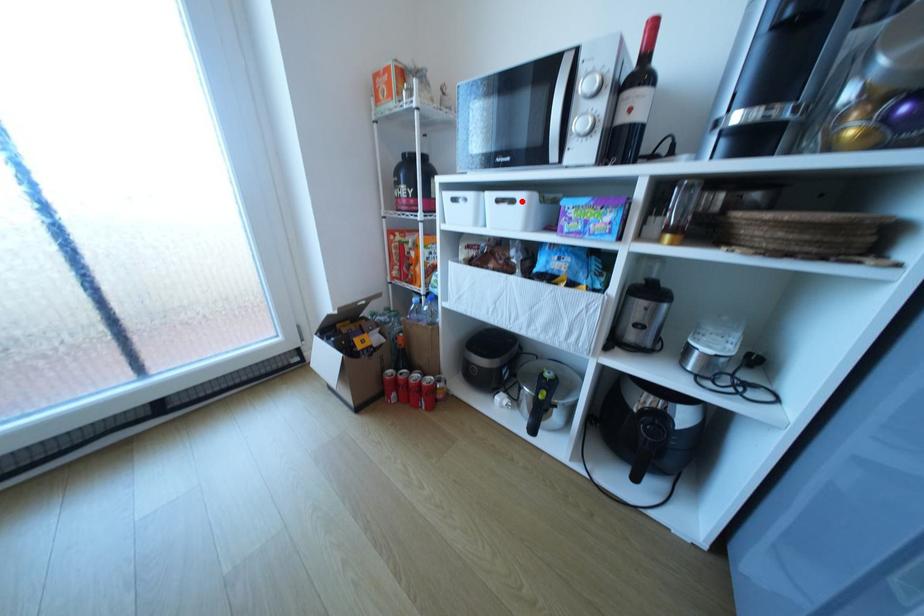
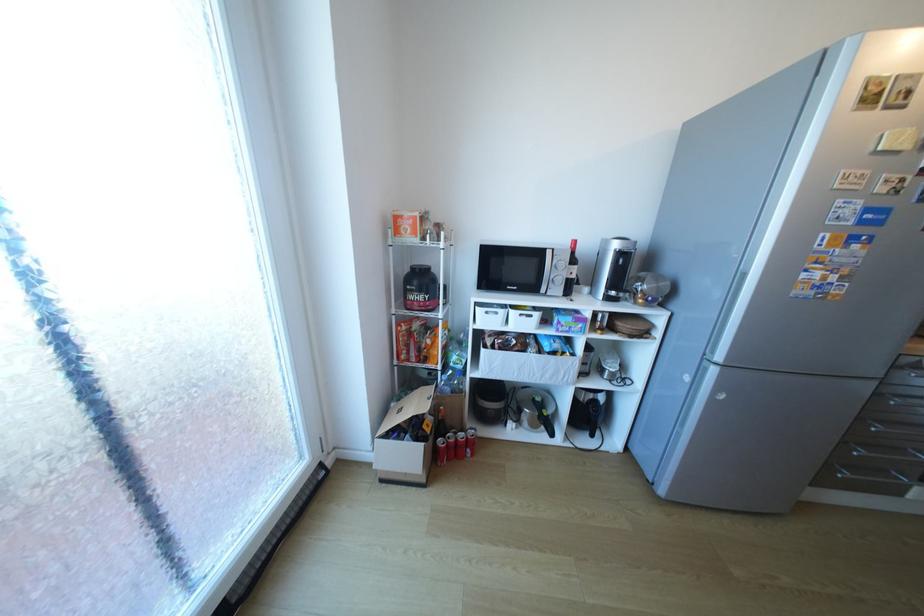
In the second image, find the point that corresponds to the highlighted location in the first image.

(540, 315)